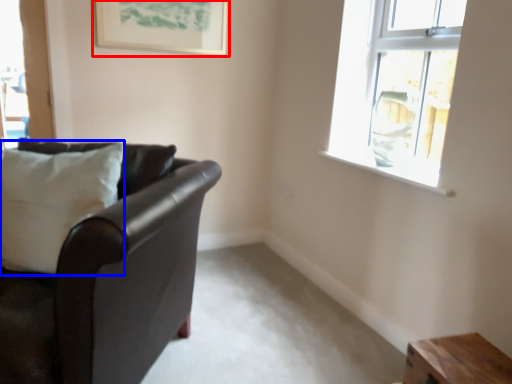
Question: Among these objects, which one is nearest to the camera, picture frame (highlighted by a red box) or pillow (highlighted by a blue box)?

Choices:
 (A) picture frame
 (B) pillow

Answer: (B)